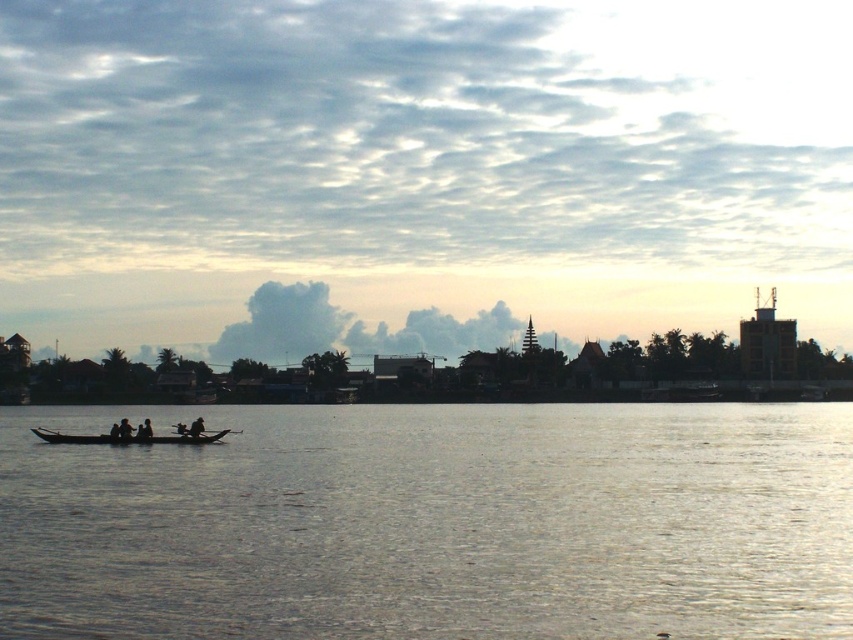
You are standing on the riverside and see the silvery reflective water at center and the wooden canoe at lower left. Which object is closer to your right side?

The silvery reflective water at center is closer to your right side because it is positioned to the right of the wooden canoe at lower left.